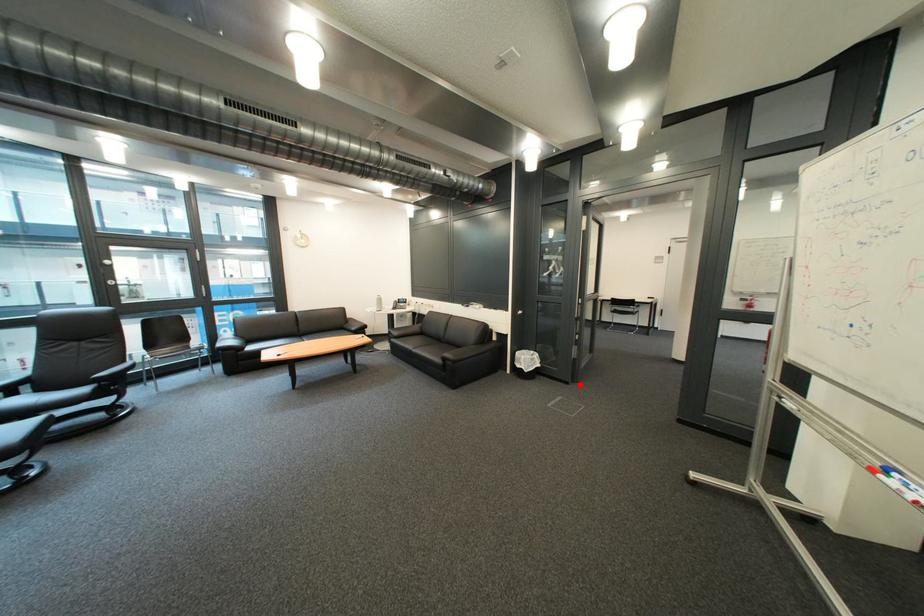
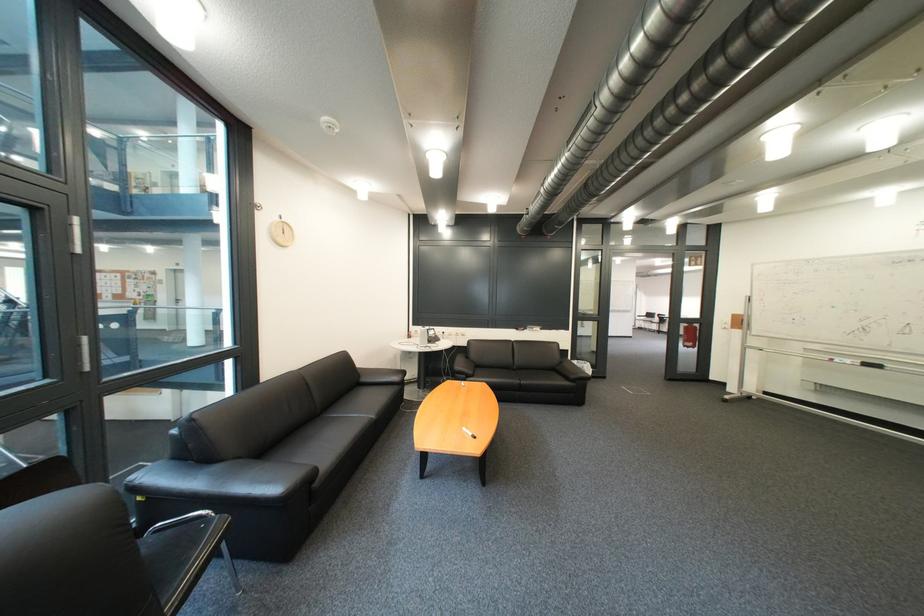
Question: I am providing you with two images of the same scene from different viewpoints. A red point is shown in image1. For the corresponding object point in image2, is it positioned nearer or farther from the camera?

Choices:
 (A) Nearer
 (B) Farther

Answer: (B)